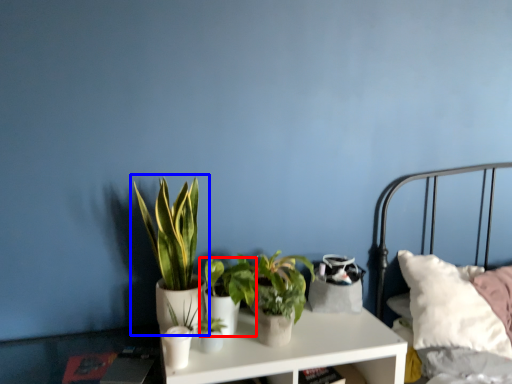
Question: Which of the following is the farthest to the observer, houseplant (highlighted by a red box) or houseplant (highlighted by a blue box)?

Choices:
 (A) houseplant
 (B) houseplant

Answer: (A)